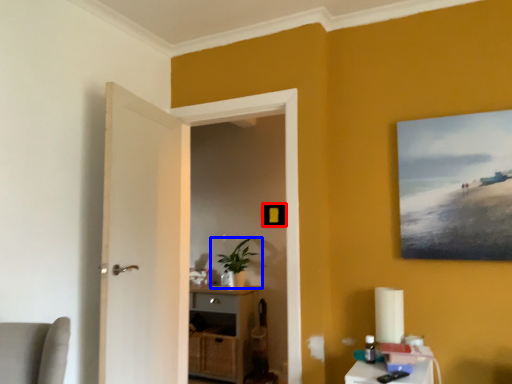
Question: Which of the following is the farthest to the observer, picture frame (highlighted by a red box) or houseplant (highlighted by a blue box)?

Choices:
 (A) picture frame
 (B) houseplant

Answer: (A)